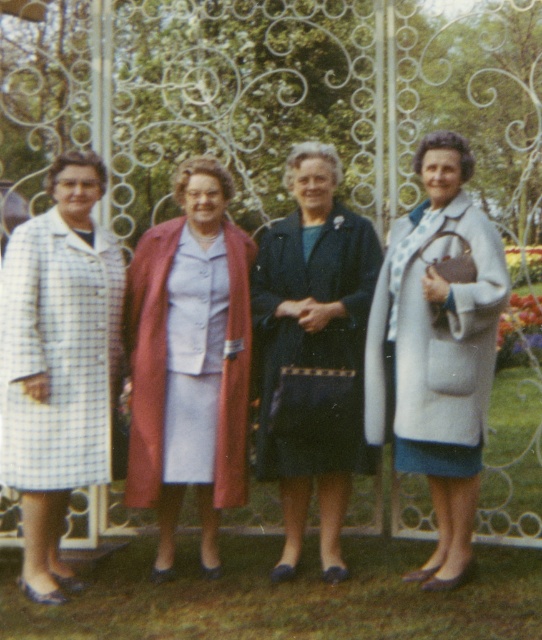
You are a tailor observing the two coats in the image. The dark blue fabric coat at center and the light gray wool coat at right. Which coat would require more fabric to create a replica of the same design?

The light gray wool coat at right would require more fabric because it has a greater width than the dark blue fabric coat at center.

You are a fashion designer observing the women in the image. You need to determine which coat is shorter between the matte pink coat at center and the checkered fabric coat at left. Based on the scene, which one is shorter?

The matte pink coat at center is shorter than the checkered fabric coat at left.